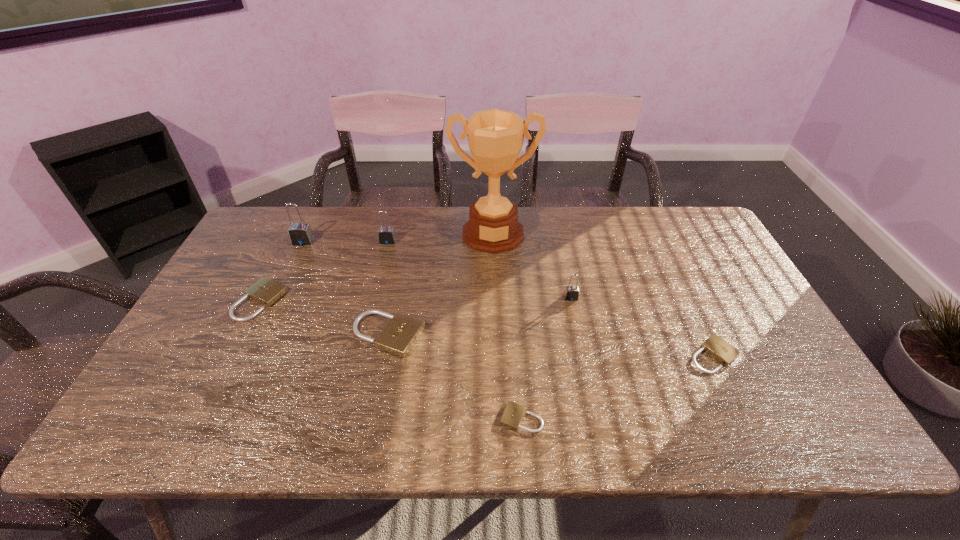
This screenshot has width=960, height=540. In order to click on free space that satisfies the following two spatial constraints: 1. on the shackle of the biggest beige padlock; 2. on the right side of the biggest gray padlock in this screenshot , I will do `click(259, 335)`.

This screenshot has width=960, height=540. In order to click on free region that satisfies the following two spatial constraints: 1. on the shackle of the seventh tallest object; 2. on the right side of the second smallest gray padlock in this screenshot , I will do `click(360, 355)`.